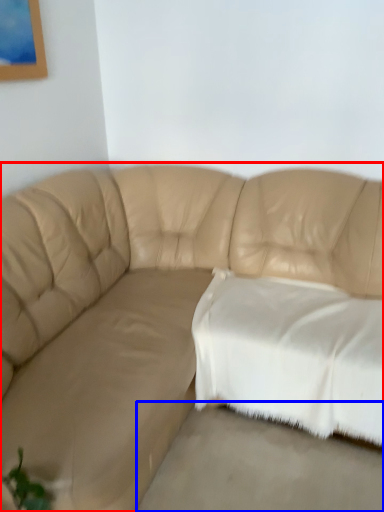
Question: Which point is further to the camera, studio couch (highlighted by a red box) or concrete (highlighted by a blue box)?

Choices:
 (A) studio couch
 (B) concrete

Answer: (B)